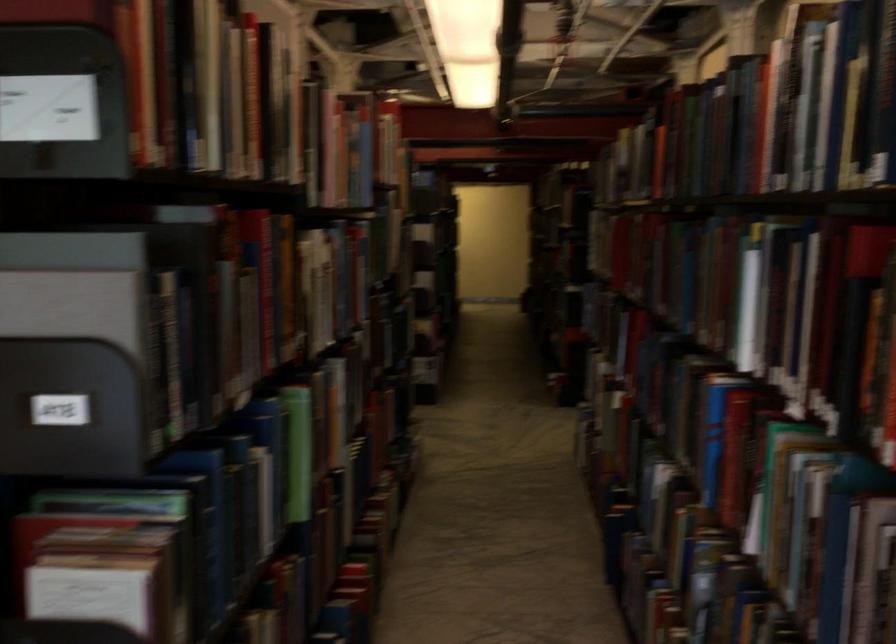
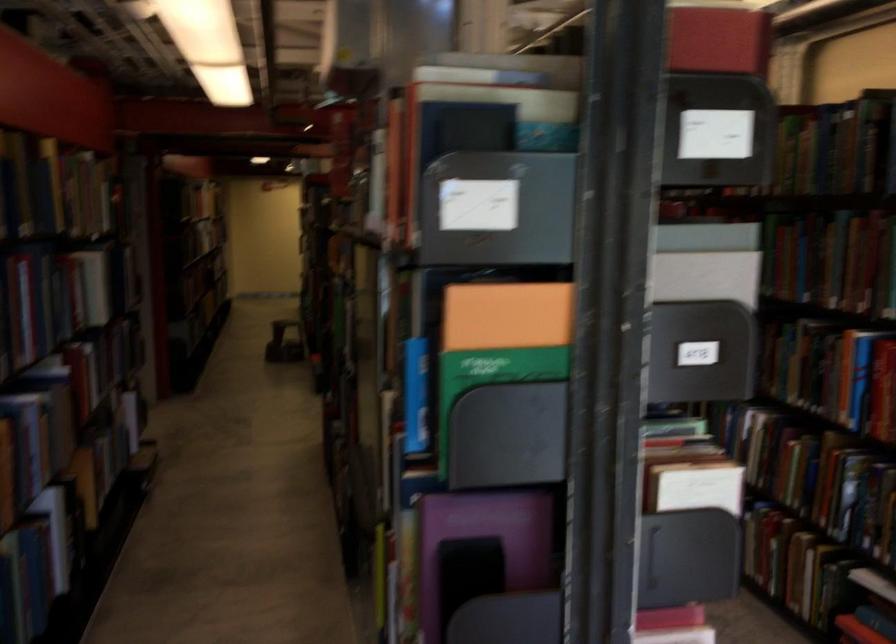
Question: I am providing you with two images of the same scene from different viewpoints. Which of the following objects are not visible in image2?

Choices:
 (A) grey pamphlet box
 (B) green hardcover book
 (C) ski pole handle
 (D) black bookend

Answer: (B)